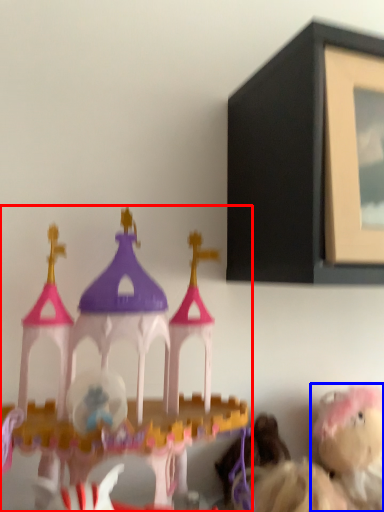
Question: Which object is closer to the camera taking this photo, toy (highlighted by a red box) or toy (highlighted by a blue box)?

Choices:
 (A) toy
 (B) toy

Answer: (A)